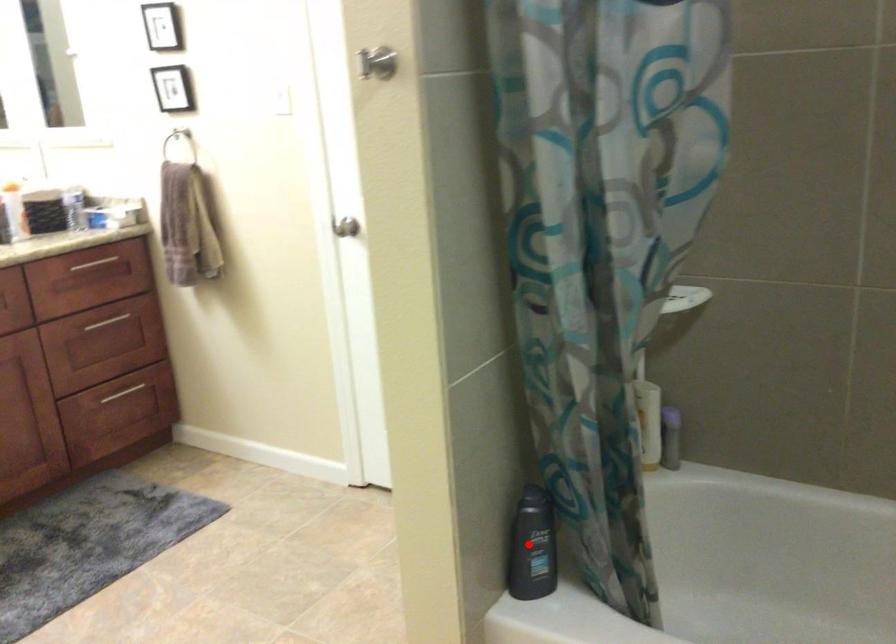
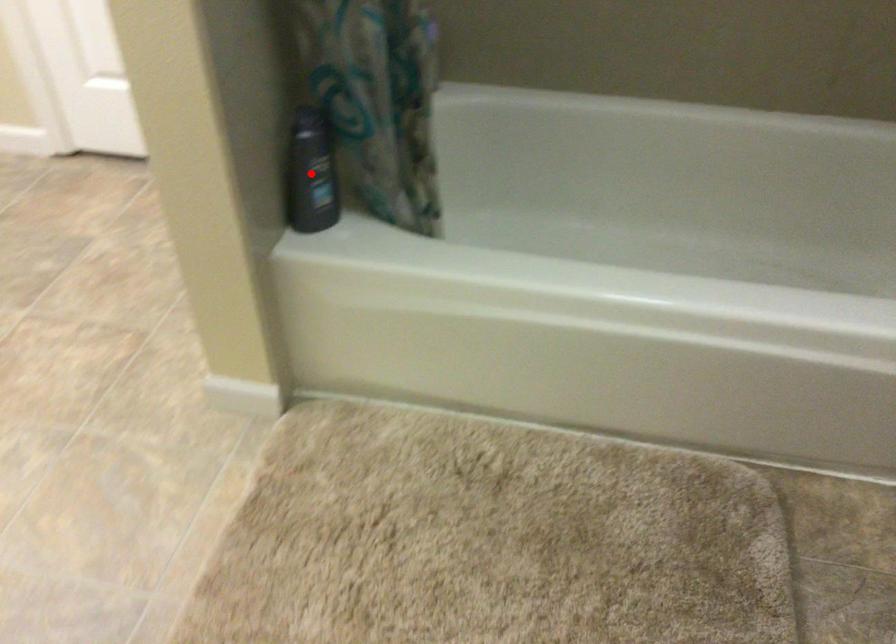
I am providing you with two images of the same scene from different viewpoints. A red point is marked on the first image and another point is marked on the second image. Do the highlighted points in image1 and image2 indicate the same real-world spot?

Yes